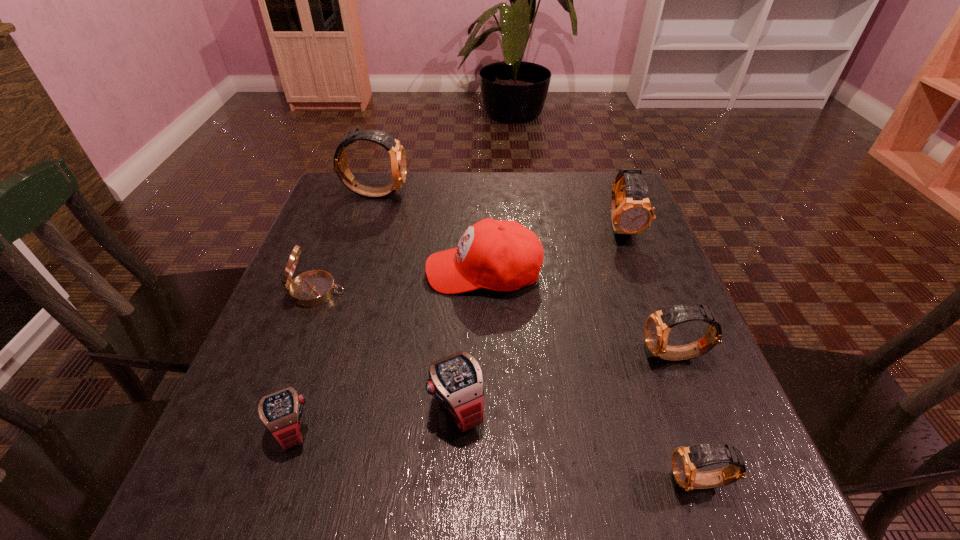
Locate an element on the screen. the nearest gold watch is located at coordinates (686, 461).

The width and height of the screenshot is (960, 540). I want to click on the nearest object, so click(686, 461).

I want to click on the left red watch, so click(281, 412).

Find the location of a particular element. The height and width of the screenshot is (540, 960). the smaller red watch is located at coordinates (281, 412).

Locate an element on the screen. free space located on the face of the tallest object is located at coordinates (437, 193).

Locate an element on the screen. The image size is (960, 540). free space located 0.190m on the face of the third smallest gold watch is located at coordinates (652, 304).

You are a GUI agent. You are given a task and a screenshot of the screen. Output one action in this format:
    pyautogui.click(x=<x>, y=<y>)
    Task: Click on the free space located on the front panel of the baseball cap
    This screenshot has height=540, width=960.
    Given the screenshot: What is the action you would take?
    pyautogui.click(x=364, y=271)

You are a GUI agent. You are given a task and a screenshot of the screen. Output one action in this format:
    pyautogui.click(x=<x>, y=<y>)
    Task: Click on the free space located on the front panel of the baseball cap
    
    Given the screenshot: What is the action you would take?
    pyautogui.click(x=297, y=271)

What are the coordinates of `vacant space located 0.150m on the front panel of the baseball cap` in the screenshot? It's located at (359, 271).

The height and width of the screenshot is (540, 960). What are the coordinates of `free spot located 0.190m on the face of the second smallest gold watch` in the screenshot? It's located at (540, 356).